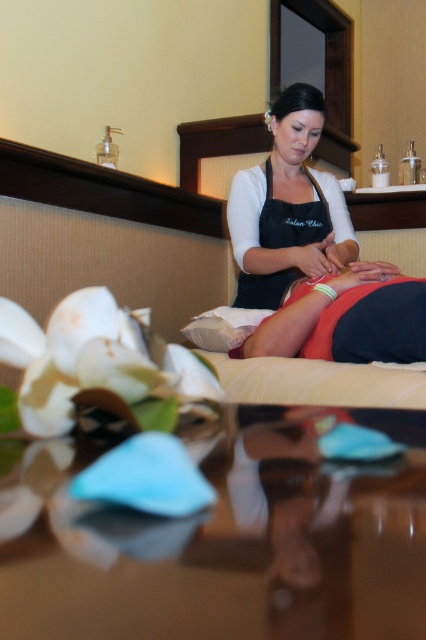
How distant is black matte apron at center from black fabric apron at center?

The distance of black matte apron at center from black fabric apron at center is 2.15 inches.

The height and width of the screenshot is (640, 426). Describe the element at coordinates (287, 208) in the screenshot. I see `black matte apron at center` at that location.

You are a GUI agent. You are given a task and a screenshot of the screen. Output one action in this format:
    pyautogui.click(x=<x>, y=<y>)
    Task: Click on the black matte apron at center
    Image resolution: width=426 pixels, height=640 pixels.
    Given the screenshot: What is the action you would take?
    coord(287,208)